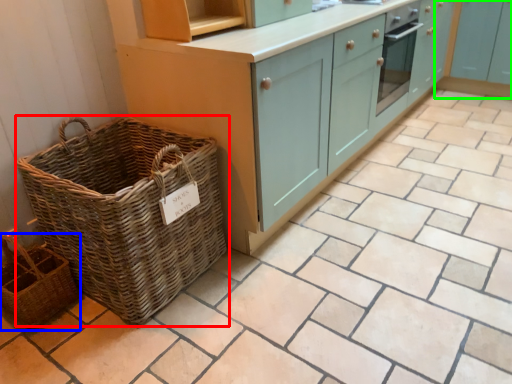
Question: Which object is positioned closest to picnic basket (highlighted by a red box)? Select from basket (highlighted by a blue box) and cabinetry (highlighted by a green box).

Choices:
 (A) basket
 (B) cabinetry

Answer: (A)